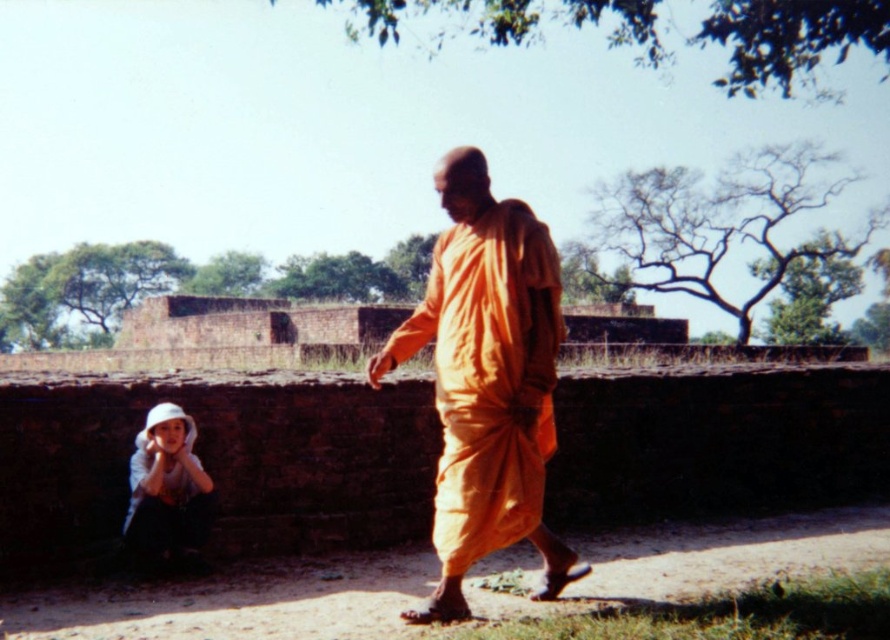
Consider the image. Is orange clothed monk at center below white cotton hat at lower left?

Actually, orange clothed monk at center is above white cotton hat at lower left.

Which is more to the right, orange clothed monk at center or white cotton hat at lower left?

From the viewer's perspective, orange clothed monk at center appears more on the right side.

Does point (519, 540) lie in front of point (160, 557)?

That is True.

Image resolution: width=890 pixels, height=640 pixels. What are the coordinates of `orange clothed monk at center` in the screenshot? It's located at (487, 380).